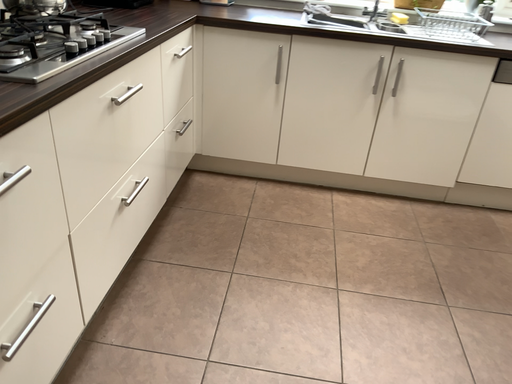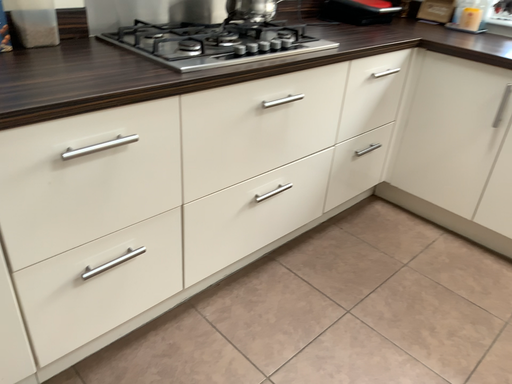
Question: Which way did the camera rotate in the video?

Choices:
 (A) rotated right
 (B) rotated left

Answer: (B)